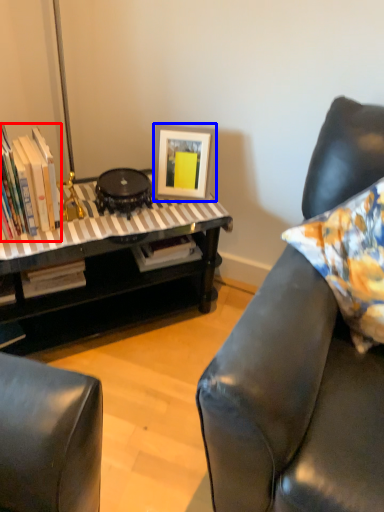
Question: Which of the following is the farthest to the observer, book (highlighted by a red box) or picture frame (highlighted by a blue box)?

Choices:
 (A) book
 (B) picture frame

Answer: (B)